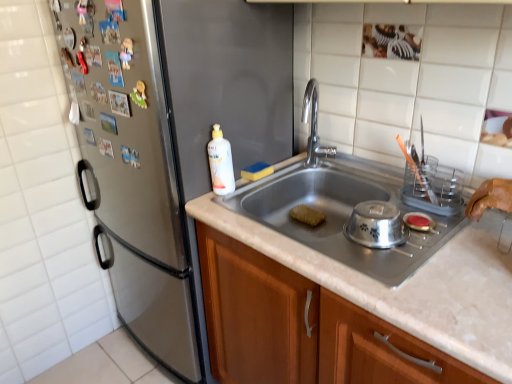
What do you see at coordinates (257, 171) in the screenshot?
I see `yellow sponge at sink, the 1th food viewed from the top` at bounding box center [257, 171].

The image size is (512, 384). What do you see at coordinates (303, 328) in the screenshot? I see `wooden cabinet at center` at bounding box center [303, 328].

Identify the location of polished stainless steel faucet at center. This screenshot has width=512, height=384. (314, 125).

The height and width of the screenshot is (384, 512). Find the location of `silver metallic bowl at sink`. silver metallic bowl at sink is located at coordinates (376, 225).

What is the approximate height of satin silver refrigerator at left?

satin silver refrigerator at left is 1.42 meters tall.

What do you see at coordinates (220, 163) in the screenshot? I see `white glossy bottle at center` at bounding box center [220, 163].

I want to click on yellow sponge at sink, acting as the first food starting from the left, so click(x=257, y=171).

From the image's perspective, which one is positioned lower, polished stainless steel faucet at center or yellow sponge at sink, acting as the first food starting from the left?

yellow sponge at sink, acting as the first food starting from the left, from the image's perspective.

Is polished stainless steel faucet at center facing away from yellow sponge at sink, the 1th food viewed from the top?

No, yellow sponge at sink, the 1th food viewed from the top, is not at the back of polished stainless steel faucet at center.

Is polished stainless steel faucet at center not near yellow sponge at sink, the 1th food viewed from the top?

No.

Which object is closer to the camera, polished stainless steel faucet at center or yellow sponge at sink, acting as the first food starting from the left?

polished stainless steel faucet at center.

Which is behind, yellow sponge at sink, placed as the 2th food when sorted from bottom to top, or silver metallic bowl at sink?

Positioned behind is yellow sponge at sink, placed as the 2th food when sorted from bottom to top.

From a real-world perspective, does yellow sponge at sink, which ranks as the second food in right-to-left order, sit lower than silver metallic bowl at sink?

Correct, in the physical world, yellow sponge at sink, which ranks as the second food in right-to-left order, is lower than silver metallic bowl at sink.

Which of these two, yellow sponge at sink, the 1th food viewed from the top, or silver metallic bowl at sink, stands shorter?

Standing shorter between the two is yellow sponge at sink, the 1th food viewed from the top.

In the scene shown: Which point is more forward, [254,166] or [367,231]?

Positioned in front is point [367,231].

Is polished stainless steel faucet at center with brown sponge at sink center, which ranks as the first food in right-to-left order?

No, polished stainless steel faucet at center is not with brown sponge at sink center, which ranks as the first food in right-to-left order.

Which of these two, polished stainless steel faucet at center or brown sponge at sink center, which ranks as the first food in right-to-left order, stands taller?

polished stainless steel faucet at center is taller.

Is polished stainless steel faucet at center turned away from brown sponge at sink center, the 2th food viewed from the left?

No, polished stainless steel faucet at center is not facing the opposite direction of brown sponge at sink center, the 2th food viewed from the left.

Between polished stainless steel faucet at center and brown sponge at sink center, acting as the first food starting from the bottom, which one has smaller width?

With smaller width is brown sponge at sink center, acting as the first food starting from the bottom.

Is there a large distance between satin silver refrigerator at left and brown sponge at sink center, which is the 2th food from top to bottom?

Actually, satin silver refrigerator at left and brown sponge at sink center, which is the 2th food from top to bottom, are a little close together.

Measure the distance from satin silver refrigerator at left to brown sponge at sink center, the 2th food viewed from the left.

satin silver refrigerator at left and brown sponge at sink center, the 2th food viewed from the left, are 25.15 inches apart from each other.

Considering the positions of point (170, 237) and point (304, 208), is point (170, 237) closer or farther from the camera than point (304, 208)?

Point (170, 237).

Identify the location of fridge that is under the brown sponge at sink center, the 2th food viewed from the left (from a real-world perspective). (169, 141).

Are wooden cabinet at center and yellow sponge at sink, acting as the first food starting from the left, beside each other?

wooden cabinet at center and yellow sponge at sink, acting as the first food starting from the left, are clearly separated.

Is wooden cabinet at center taller than yellow sponge at sink, placed as the 2th food when sorted from bottom to top?

Indeed, wooden cabinet at center has a greater height compared to yellow sponge at sink, placed as the 2th food when sorted from bottom to top.

Which object is more forward, wooden cabinet at center or yellow sponge at sink, acting as the first food starting from the left?

wooden cabinet at center is more forward.

Considering the relative sizes of wooden cabinet at center and white glossy bottle at center in the image provided, is wooden cabinet at center shorter than white glossy bottle at center?

No.

Where is `bottle that appears above the wooden cabinet at center (from a real-world perspective)`? The image size is (512, 384). bottle that appears above the wooden cabinet at center (from a real-world perspective) is located at coordinates (220, 163).

Is wooden cabinet at center bigger or smaller than white glossy bottle at center?

Considering their sizes, wooden cabinet at center takes up more space than white glossy bottle at center.

Considering the relative sizes of wooden cabinet at center and white glossy bottle at center in the image provided, is wooden cabinet at center wider than white glossy bottle at center?

Yes.

In the scene shown: How many degrees apart are the facing directions of wooden cabinet at center and satin silver refrigerator at left?

The angular difference between wooden cabinet at center and satin silver refrigerator at left is 0.0427 degrees.

From the image's perspective, is wooden cabinet at center over satin silver refrigerator at left?

Incorrect, from the image's perspective, wooden cabinet at center is lower than satin silver refrigerator at left.

From the picture: From a real-world perspective, which is physically below, wooden cabinet at center or satin silver refrigerator at left?

In real-world perspective, wooden cabinet at center is lower.

Is wooden cabinet at center positioned behind satin silver refrigerator at left?

No.

From a real-world perspective, starting from the polished stainless steel faucet at center, which food is the 1st one below it? Please provide its 2D coordinates.

[(257, 171)]

Find the location of a particular element. Image resolution: width=512 pixels, height=384 pixels. appliance to the right of yellow sponge at sink, which ranks as the second food in right-to-left order is located at coordinates (376, 225).

Which object lies nearer to the anchor point polished stainless steel faucet at center, wooden cabinet at center or white glossy bottle at center?

Among the two, white glossy bottle at center is located nearer to polished stainless steel faucet at center.

When comparing their distances from wooden cabinet at center, does polished stainless steel faucet at center or yellow sponge at sink, which ranks as the second food in right-to-left order, seem closer?

yellow sponge at sink, which ranks as the second food in right-to-left order, lies closer to wooden cabinet at center than the other object.

Estimate the real-world distances between objects in this image. Which object is further from satin silver refrigerator at left, white glossy bottle at center or silver metallic bowl at sink?

Among the two, silver metallic bowl at sink is located further to satin silver refrigerator at left.

Considering their positions, is white glossy bottle at center positioned further to wooden cabinet at center than yellow sponge at sink, acting as the first food starting from the left?

yellow sponge at sink, acting as the first food starting from the left.

Considering their positions, is brown sponge at sink center, acting as the first food starting from the bottom, positioned closer to wooden cabinet at center than satin silver refrigerator at left?

satin silver refrigerator at left.

From the image, which object appears to be farther from yellow sponge at sink, placed as the 2th food when sorted from bottom to top, satin silver refrigerator at left or wooden cabinet at center?

satin silver refrigerator at left.

Looking at the image, which one is located closer to brown sponge at sink center, acting as the first food starting from the bottom, yellow sponge at sink, acting as the first food starting from the left, or satin silver refrigerator at left?

yellow sponge at sink, acting as the first food starting from the left, lies closer to brown sponge at sink center, acting as the first food starting from the bottom, than the other object.

Looking at the image, which one is located further to white glossy bottle at center, satin silver refrigerator at left or polished stainless steel faucet at center?

polished stainless steel faucet at center is further to white glossy bottle at center.

Find the location of a particular element. The width and height of the screenshot is (512, 384). food located between wooden cabinet at center and brown sponge at sink center, the 2th food viewed from the left, in the depth direction is located at coordinates (257, 171).

Locate an element on the screen. The height and width of the screenshot is (384, 512). bottle between wooden cabinet at center and yellow sponge at sink, acting as the first food starting from the left, along the z-axis is located at coordinates point(220,163).

I want to click on tap located between satin silver refrigerator at left and silver metallic bowl at sink in the left-right direction, so click(x=314, y=125).

Image resolution: width=512 pixels, height=384 pixels. Find the location of `appliance between polished stainless steel faucet at center and wooden cabinet at center from top to bottom`. appliance between polished stainless steel faucet at center and wooden cabinet at center from top to bottom is located at coordinates (376, 225).